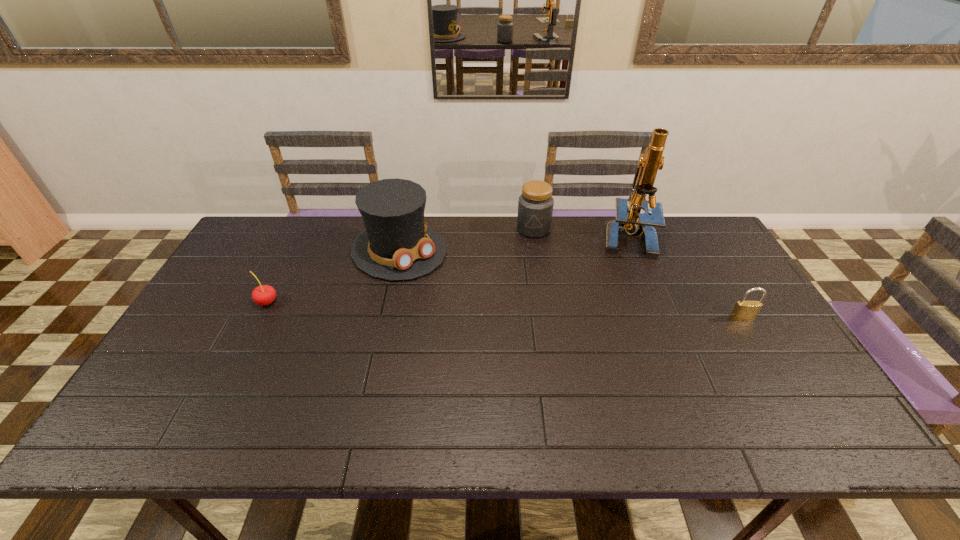
Identify the location of vacant space situated 0.060m on the front of the cherry. (255, 326).

Where is `free space located on the front-facing side of the rightmost object`? free space located on the front-facing side of the rightmost object is located at coordinates (x=753, y=334).

Image resolution: width=960 pixels, height=540 pixels. Identify the location of blank space located 0.170m on the surface of the third object from left to right near the warning symbol. (522, 271).

Find the location of a particular element. free space located on the surface of the third object from left to right near the warning symbol is located at coordinates (527, 253).

Locate an element on the screen. vacant space situated on the surface of the third object from left to right near the warning symbol is located at coordinates (522, 271).

Identify the location of vacant space located 0.260m with goggles on the front of the fourth object from right to left. (484, 320).

Locate an element on the screen. vacant area located with goggles on the front of the fourth object from right to left is located at coordinates (448, 291).

The image size is (960, 540). Find the location of `free spot located with goggles on the front of the fourth object from right to left`. free spot located with goggles on the front of the fourth object from right to left is located at coordinates (496, 330).

You are a GUI agent. You are given a task and a screenshot of the screen. Output one action in this format:
    pyautogui.click(x=<x>, y=<y>)
    Task: Click on the vacant area situated at the eyepiece of the microscope
    
    Given the screenshot: What is the action you would take?
    pyautogui.click(x=567, y=320)

The image size is (960, 540). What are the coordinates of `vacant space located 0.160m at the eyepiece of the microscope` in the screenshot? It's located at (596, 282).